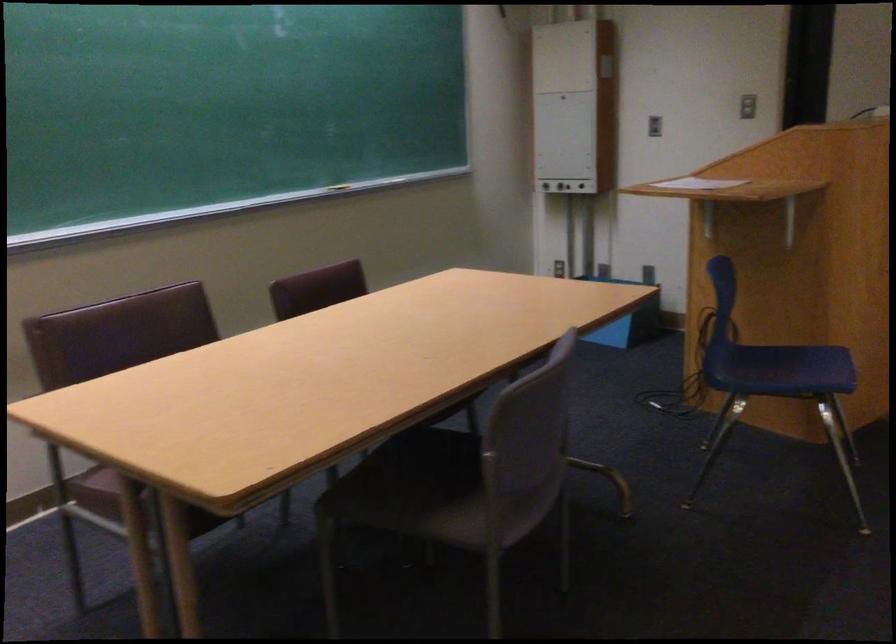
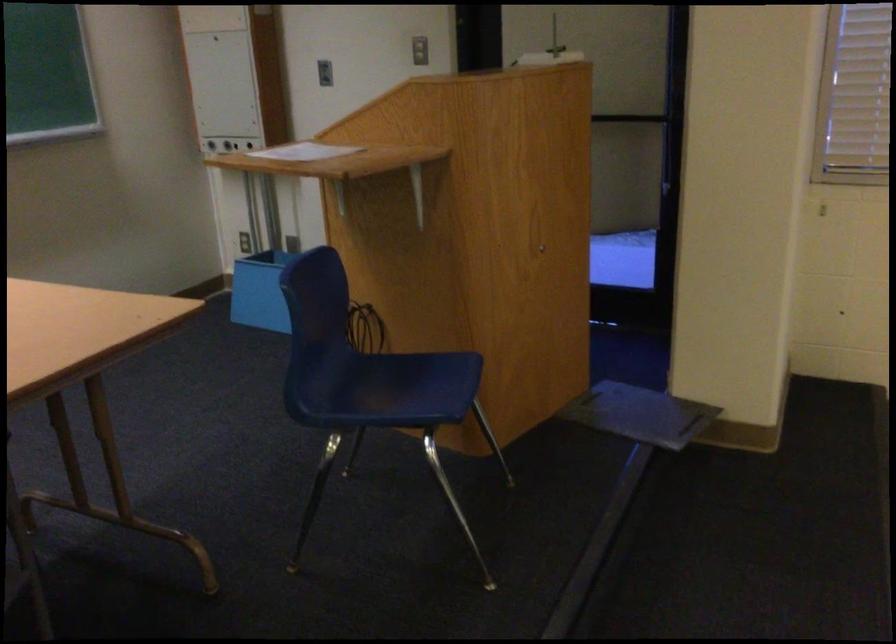
The images are taken continuously from a first-person perspective. In which direction are you moving?

The movement direction of the cameraman is right, forward.